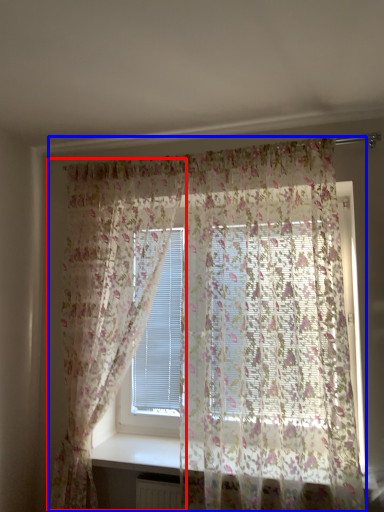
Question: Which point is closer to the camera, curtain (highlighted by a red box) or curtain (highlighted by a blue box)?

Choices:
 (A) curtain
 (B) curtain

Answer: (B)